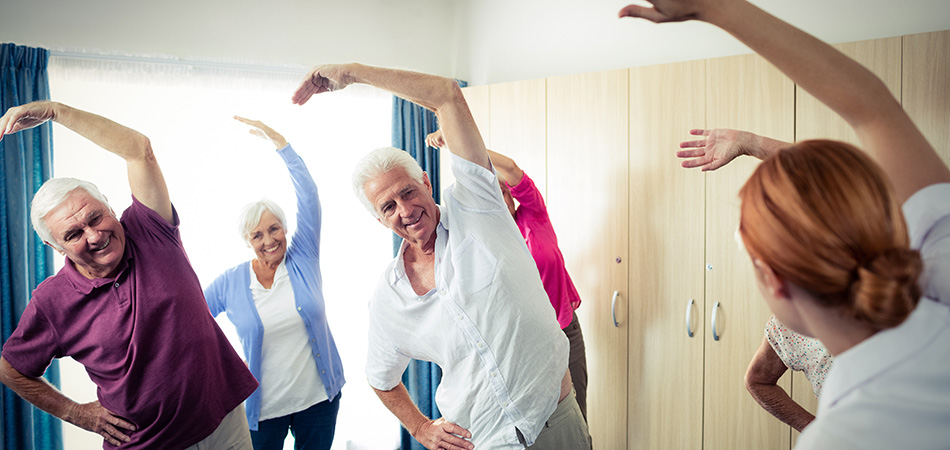
At what (x,y) coordinates should I click in order to perform the action: click on closet doors. Please return your answer as a coordinate pair (x, y). Image resolution: width=950 pixels, height=450 pixels. Looking at the image, I should click on (471, 103), (519, 112), (595, 130), (650, 125), (746, 104), (830, 122), (931, 78).